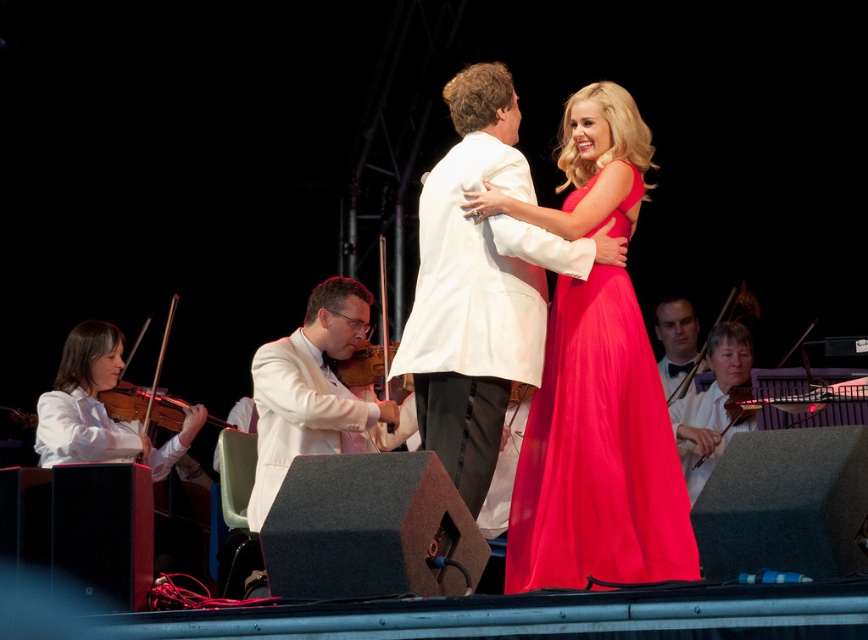
Question: Which point is farther to the camera?

Choices:
 (A) white smooth violin at lower left
 (B) shiny silk dress at center

Answer: (A)

Question: Considering the relative positions of white glossy violinist at center and wooden violin at lower left in the image provided, where is white glossy violinist at center located with respect to wooden violin at lower left?

Choices:
 (A) right
 (B) left

Answer: (A)

Question: Where is white satin suit at center located in relation to wooden violin at center in the image?

Choices:
 (A) above
 (B) below

Answer: (A)

Question: Which object is positioned farthest from the wooden violin at lower left?

Choices:
 (A) white glossy violinist at center
 (B) wooden violin at center

Answer: (B)

Question: Is white satin suit at center below wooden violin at lower right?

Choices:
 (A) yes
 (B) no

Answer: (B)

Question: Which object is the closest to the shiny silk dress at center?

Choices:
 (A) white glossy violinist at center
 (B) wooden violin at lower left
 (C) white satin suit at center
 (D) white smooth violin at lower left

Answer: (C)